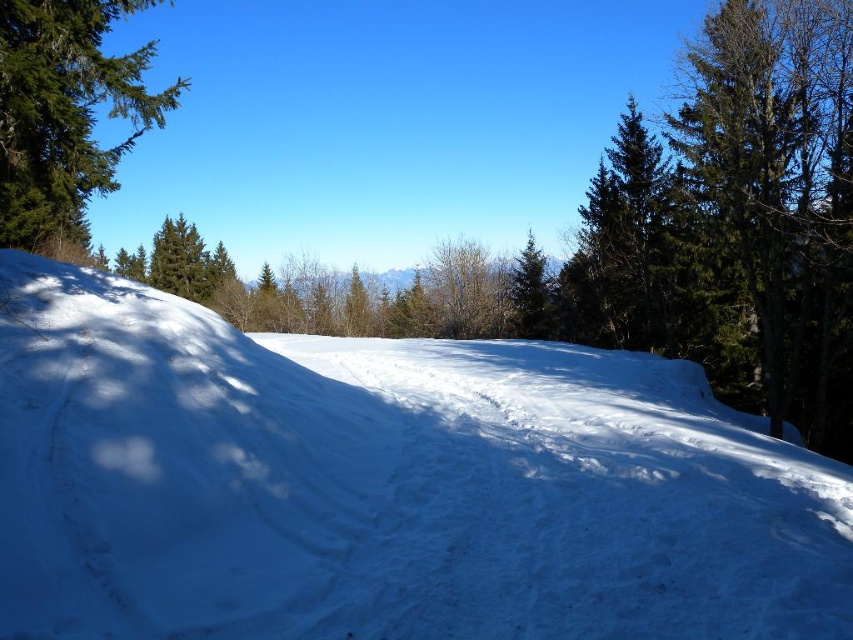
Does white powdery snow at center have a smaller size compared to green textured pine tree at upper left?

Correct, white powdery snow at center occupies less space than green textured pine tree at upper left.

This screenshot has height=640, width=853. What do you see at coordinates (386, 484) in the screenshot? I see `white powdery snow at center` at bounding box center [386, 484].

You are a GUI agent. You are given a task and a screenshot of the screen. Output one action in this format:
    pyautogui.click(x=<x>, y=<y>)
    Task: Click on the white powdery snow at center
    
    Given the screenshot: What is the action you would take?
    pyautogui.click(x=386, y=484)